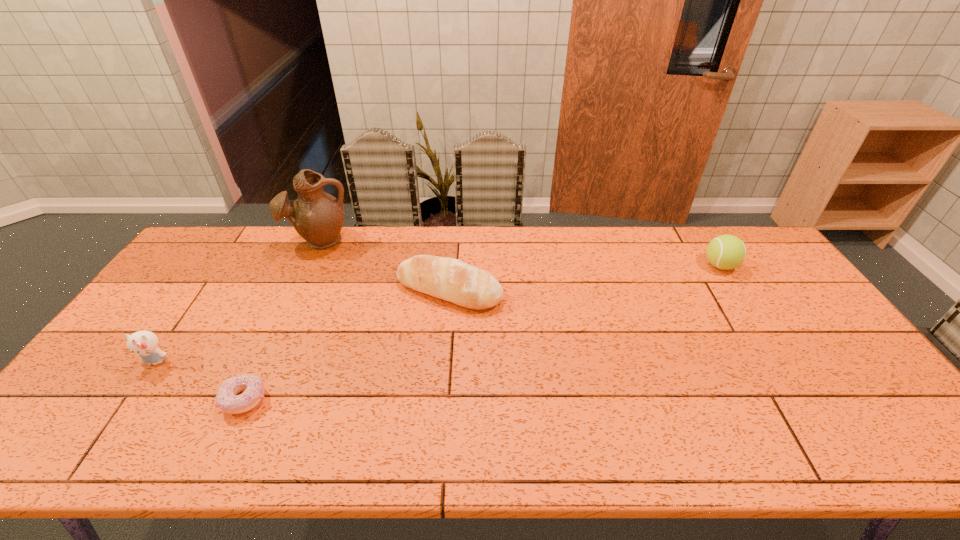
Find the location of `free region at the right edge`. free region at the right edge is located at coordinates (835, 379).

What are the coordinates of `free space at the far right corner` in the screenshot? It's located at (749, 266).

Locate an element on the screen. free space between the pitcher and the rightmost object is located at coordinates (520, 253).

Locate an element on the screen. The height and width of the screenshot is (540, 960). free space between the bread and the pitcher is located at coordinates (384, 265).

Locate an element on the screen. unoccupied position between the rightmost object and the pitcher is located at coordinates (520, 253).

Locate an element on the screen. This screenshot has height=540, width=960. free spot between the rightmost object and the fourth object from left to right is located at coordinates (585, 278).

You are a GUI agent. You are given a task and a screenshot of the screen. Output one action in this format:
    pyautogui.click(x=<x>, y=<y>)
    Task: Click on the vacant point located between the fourth farthest object and the second object from right to left
    This screenshot has width=960, height=540.
    Given the screenshot: What is the action you would take?
    pyautogui.click(x=302, y=326)

Identify the location of empty location between the leftmost object and the rightmost object. The image size is (960, 540). (438, 314).

The width and height of the screenshot is (960, 540). I want to click on empty space that is in between the tallest object and the fourth farthest object, so click(x=238, y=301).

I want to click on free space between the tallest object and the rightmost object, so click(x=520, y=253).